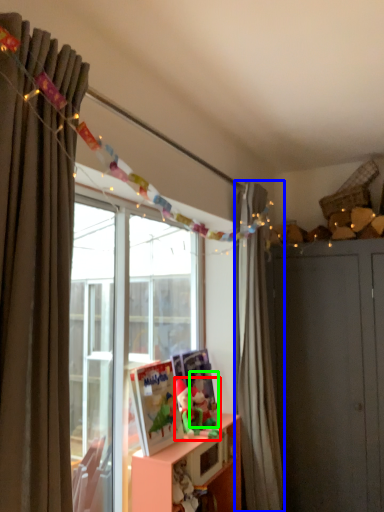
Question: Considering the real-world distances, which object is farthest from toy (highlighted by a red box)? curtain (highlighted by a blue box) or toy (highlighted by a green box)?

Choices:
 (A) curtain
 (B) toy

Answer: (A)